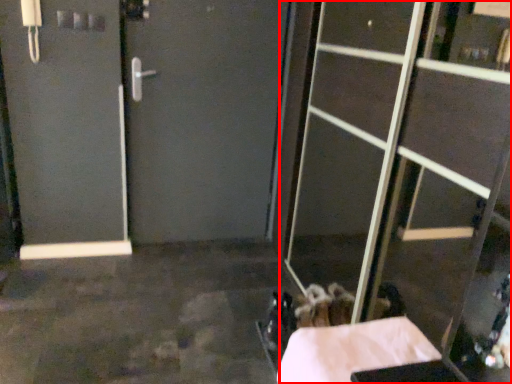
Question: Considering the relative positions of glass door (annotated by the red box) and concrete in the image provided, where is glass door (annotated by the red box) located with respect to the staircase?

Choices:
 (A) right
 (B) left

Answer: (A)